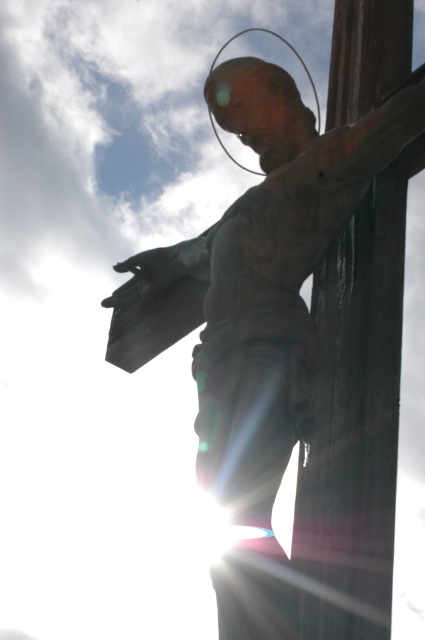
How much distance is there between bronze statue at center and wooden post at right?

bronze statue at center is 3.76 feet away from wooden post at right.

Is point (238, 113) positioned after point (360, 90)?

That is True.

Between point (311, 148) and point (379, 628), which one is positioned in front?

Positioned in front is point (379, 628).

Where is `bronze statue at center`? The height and width of the screenshot is (640, 425). bronze statue at center is located at coordinates (257, 275).